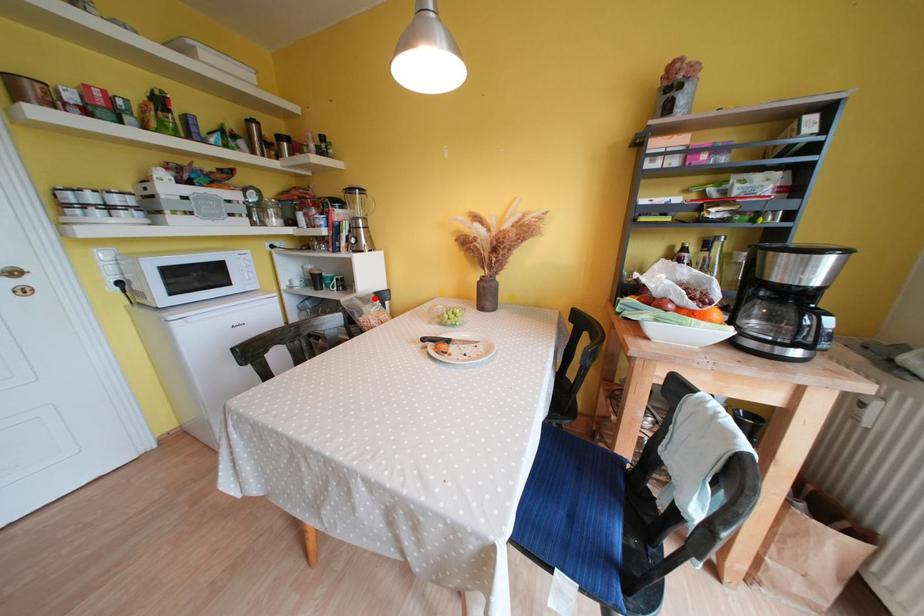
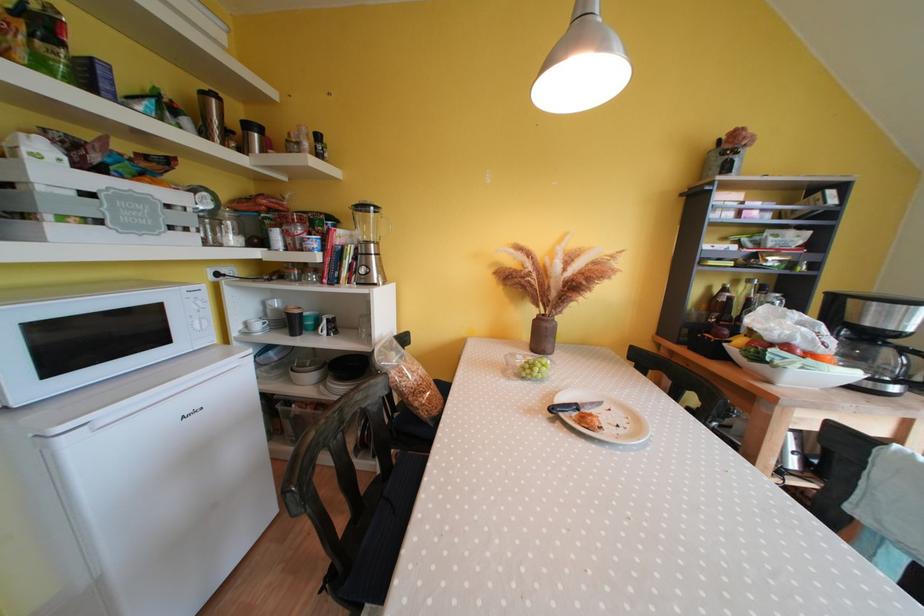
In the second image, find the point that corresponds to the highlighted location in the first image.

(397, 345)